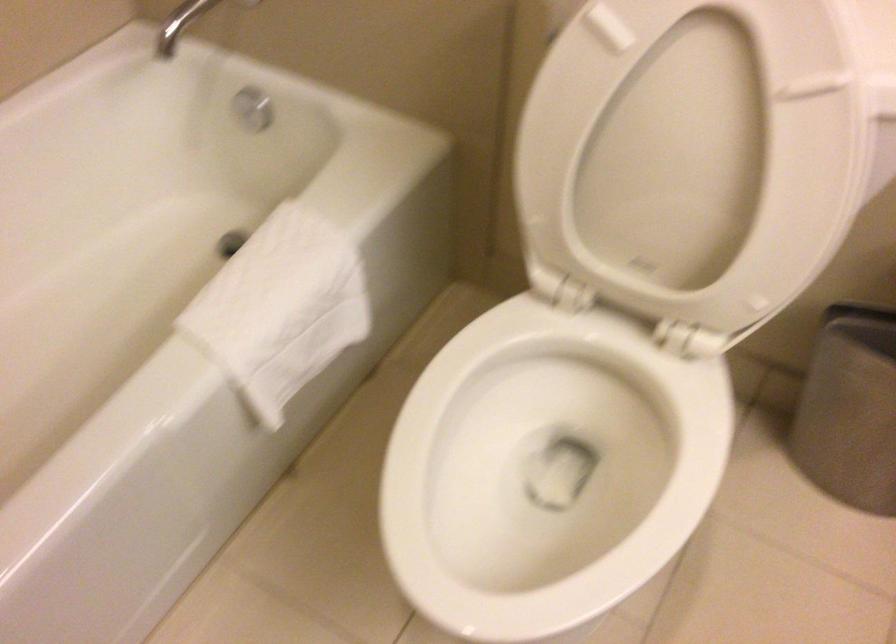
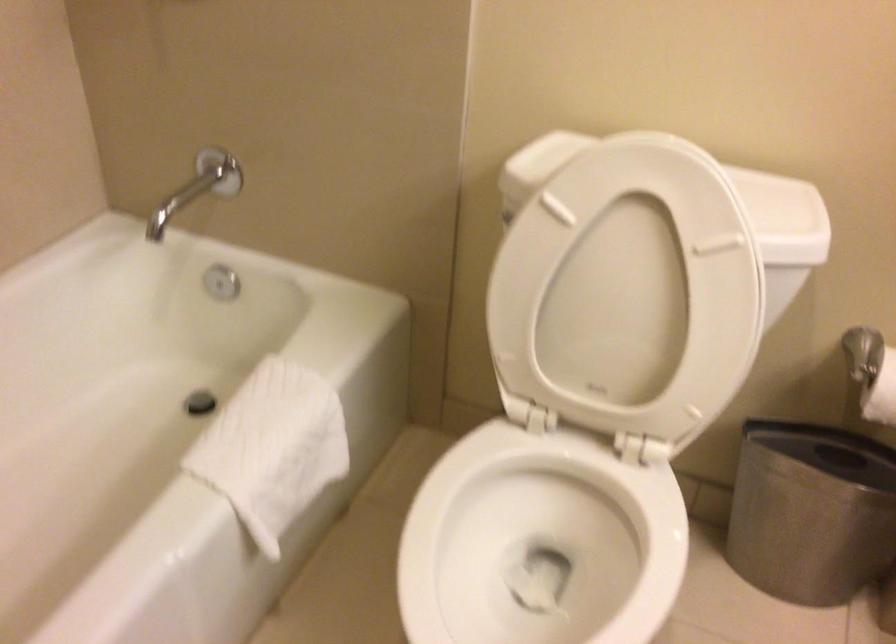
In the second image, find the point that corresponds to (278,307) in the first image.

(272, 448)